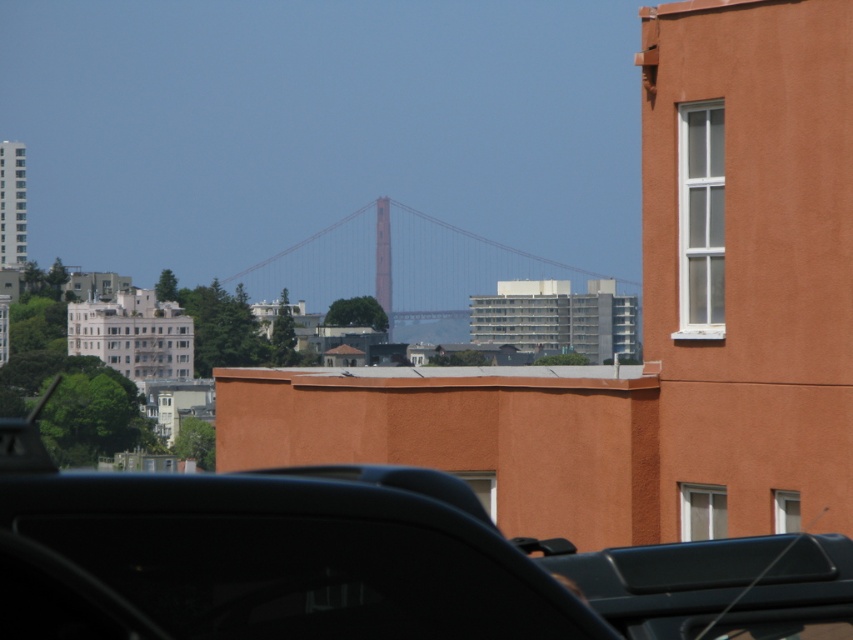
You are a photographer planning to capture a wide shot of the red painted steel suspension bridge at center. However, there is a shiny black car at center in the way. Can the car be moved to the side without blocking the bridge in the frame?

The shiny black car at center has a lesser width compared to the red painted steel suspension bridge at center. Therefore, moving the car to the side would allow the bridge to be fully visible in the frame since the car is narrower and can be positioned away without obstructing the bridge.

You are standing on a rooftop and looking at the scene described. There are two points marked in the image. The first point is at coordinates point[306,620] and the second point is at point[465,292]. Which point is closer to you?

Point[306,620] is closer to the camera than point[465,292].